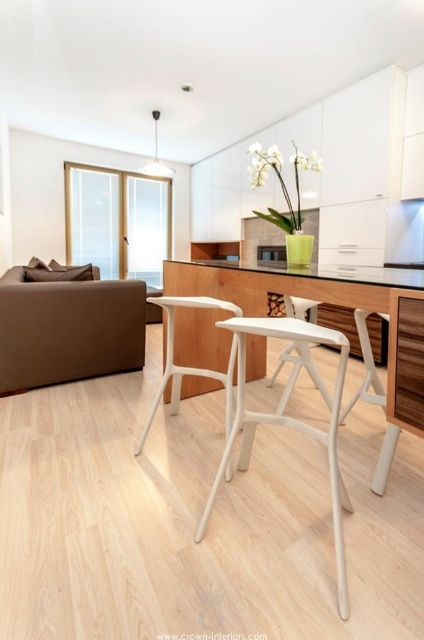
You are hosting a dinner party and need to seat guests at the white plastic table at center. The guests are 6 feet tall. Will their knees hit the white plastic bar stool at center underneath the table?

The white plastic table at center is taller than the white plastic bar stool at center, so the bar stool is shorter than the table. Since the guests are 6 feet tall, their knees may hit the bar stool if they sit at the table.

You are planning to place a new coffee table in front of the brown leather couch at left. Based on their positions, which direction should you move the white plastic table at center to make space?

Since the brown leather couch at left is to the left of the white plastic table at center, you should move the white plastic table at center to the right to create space for the new coffee table in front of the brown leather couch at left.

You are standing at the entrance of the living space and want to sit down on the brown leather couch at left. Which direction should you walk to reach it?

You should walk to the left to reach the brown leather couch at left since it is located at point (x=67, y=330).